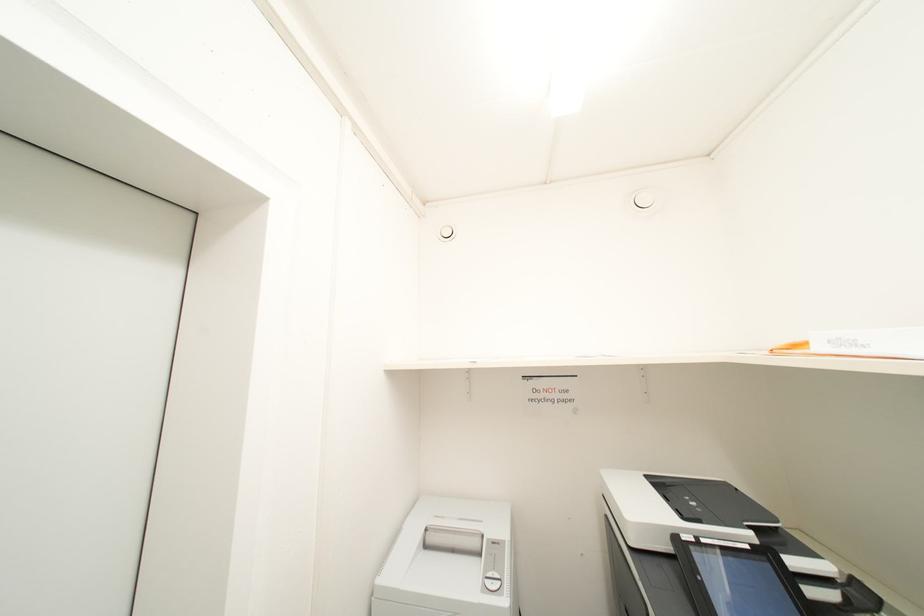
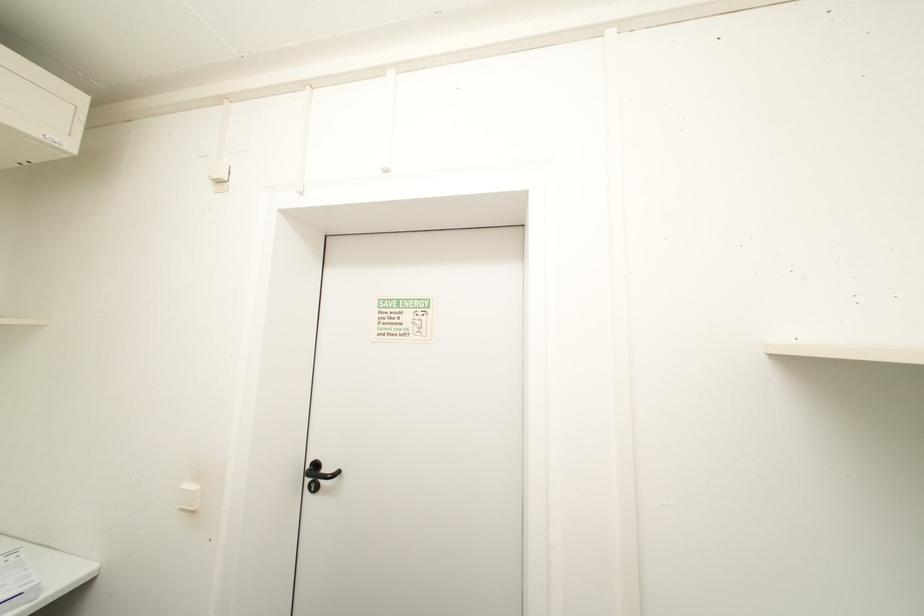
Question: The images are taken continuously from a first-person perspective. In which direction is your viewpoint rotating?

Choices:
 (A) Left
 (B) Right
 (C) Up
 (D) Down

Answer: (A)